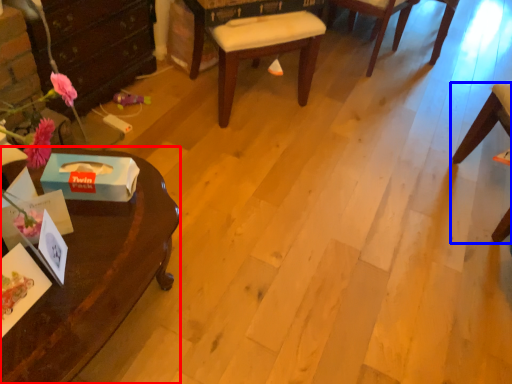
Question: Which of the following is the farthest to the observer, desk (highlighted by a red box) or chair (highlighted by a blue box)?

Choices:
 (A) desk
 (B) chair

Answer: (B)